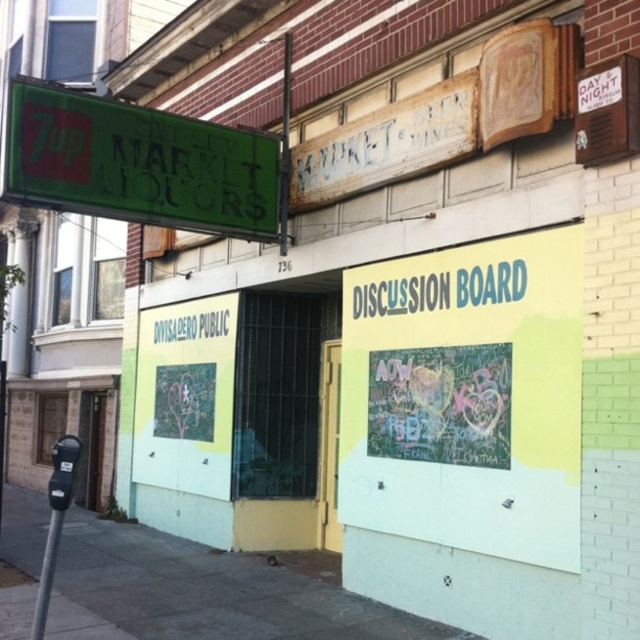
Who is more forward, (369, 323) or (202, 321)?

Point (369, 323) is more forward.

The image size is (640, 640). What do you see at coordinates (467, 397) in the screenshot? I see `chalkboard discussion board at center` at bounding box center [467, 397].

Locate an element on the screen. The width and height of the screenshot is (640, 640). chalkboard discussion board at center is located at coordinates (467, 397).

Who is taller, chalkboard discussion board at center or blue plastic discussion board at center?

chalkboard discussion board at center

Does point (440, 493) come behind point (458, 288)?

No, it is not.

Between point (432, 492) and point (413, 284), which one is positioned behind?

Positioned behind is point (413, 284).

This screenshot has width=640, height=640. Identify the location of chalkboard discussion board at center. (467, 397).

What do you see at coordinates (54, 520) in the screenshot? I see `metallic gray parking meter at lower left` at bounding box center [54, 520].

Is metallic gray parking meter at lower left taller than blacktexturedwriting at center?

No.

Is point (45, 541) in front of point (176, 336)?

Yes, it is.

Find the location of a particular element. The image size is (640, 640). metallic gray parking meter at lower left is located at coordinates (54, 520).